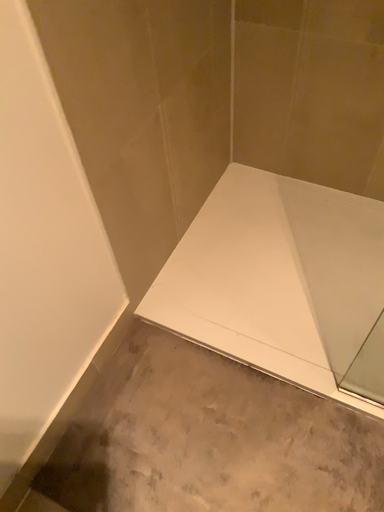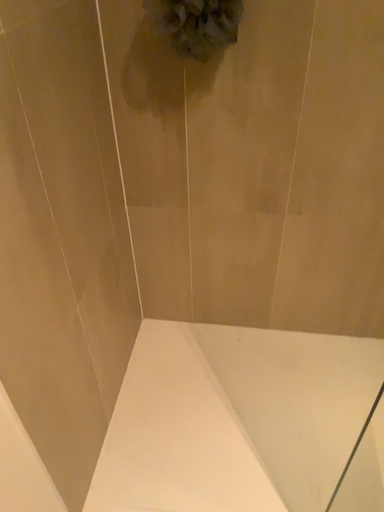
Question: Which way did the camera rotate in the video?

Choices:
 (A) rotated upward
 (B) rotated downward

Answer: (A)